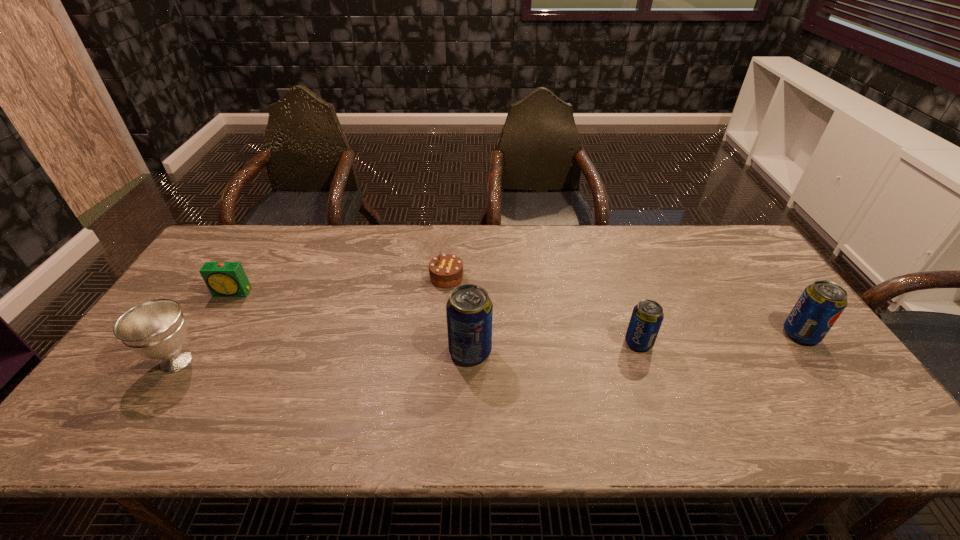
Where is `vacant region that satisfies the following two spatial constraints: 1. on the front-facing side of the fifth tallest object; 2. on the right side of the leftmost soda`? The height and width of the screenshot is (540, 960). vacant region that satisfies the following two spatial constraints: 1. on the front-facing side of the fifth tallest object; 2. on the right side of the leftmost soda is located at coordinates (197, 351).

The image size is (960, 540). What are the coordinates of `free location that satisfies the following two spatial constraints: 1. on the front-facing side of the second shortest soda; 2. on the left side of the alarm clock` in the screenshot? It's located at (207, 334).

You are a GUI agent. You are given a task and a screenshot of the screen. Output one action in this format:
    pyautogui.click(x=<x>, y=<y>)
    Task: Click on the free location that satisfies the following two spatial constraints: 1. on the front-facing side of the alarm clock; 2. on the right side of the tallest object
    
    Given the screenshot: What is the action you would take?
    pyautogui.click(x=197, y=351)

Identify the location of free location that satisfies the following two spatial constraints: 1. on the back side of the chalice; 2. on the left side of the leftmost soda. (183, 351).

The image size is (960, 540). Find the location of `free space that satisfies the following two spatial constraints: 1. on the back side of the tallest object; 2. on the right side of the rightmost object`. free space that satisfies the following two spatial constraints: 1. on the back side of the tallest object; 2. on the right side of the rightmost object is located at coordinates 470,334.

Find the location of a particular element. Image resolution: width=960 pixels, height=540 pixels. vacant point that satisfies the following two spatial constraints: 1. on the front-facing side of the shortest soda; 2. on the left side of the alarm clock is located at coordinates (202, 342).